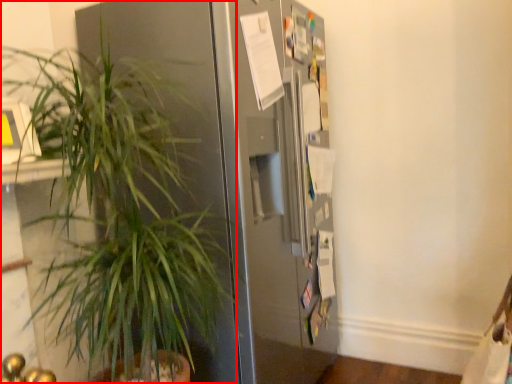
Question: From the image, what is the correct spatial relationship of houseplant (annotated by the red box) in relation to refrigerator?

Choices:
 (A) right
 (B) left

Answer: (B)